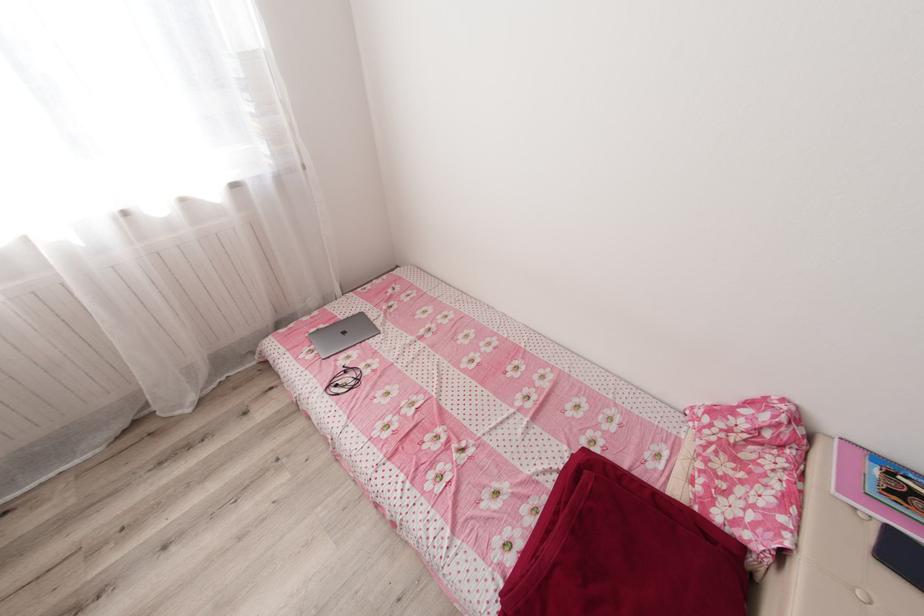
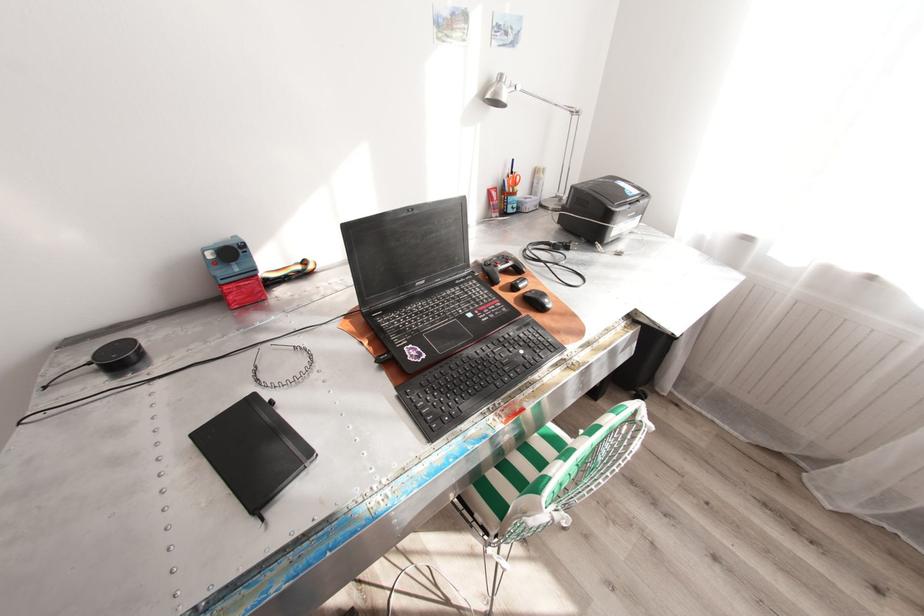
How did the camera likely rotate?

The camera's rotation is toward left-down.